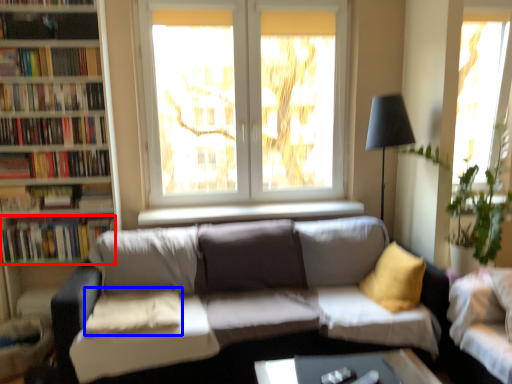
Question: Which object appears closest to the camera in this image, book (highlighted by a red box) or pillow (highlighted by a blue box)?

Choices:
 (A) book
 (B) pillow

Answer: (B)